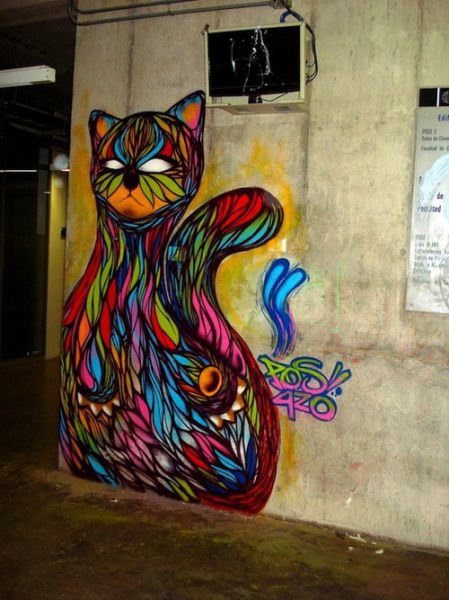
Where is `wall`? The height and width of the screenshot is (600, 449). wall is located at coordinates (358, 283).